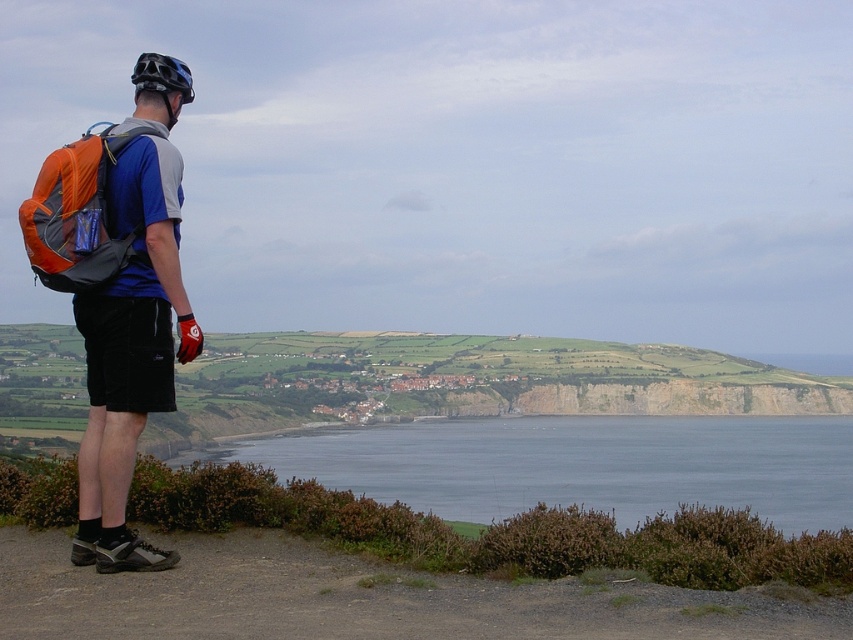
Question: Is orange fabric backpack at left to the right of black matte helmet at upper left from the viewer's perspective?

Choices:
 (A) no
 (B) yes

Answer: (A)

Question: Is matte orange backpack at left to the right of black matte helmet at upper left from the viewer's perspective?

Choices:
 (A) yes
 (B) no

Answer: (A)

Question: Which object is closer to the camera taking this photo?

Choices:
 (A) orange fabric backpack at left
 (B) matte orange backpack at left
 (C) blue water at lower center
 (D) black matte helmet at upper left

Answer: (A)

Question: Which object is positioned farthest from the black matte helmet at upper left?

Choices:
 (A) orange fabric backpack at left
 (B) matte orange backpack at left

Answer: (B)

Question: Among these points, which one is farthest from the camera?

Choices:
 (A) (55, 269)
 (B) (126, 452)
 (C) (171, 61)

Answer: (C)

Question: Is blue water at lower center above matte orange backpack at left?

Choices:
 (A) no
 (B) yes

Answer: (A)